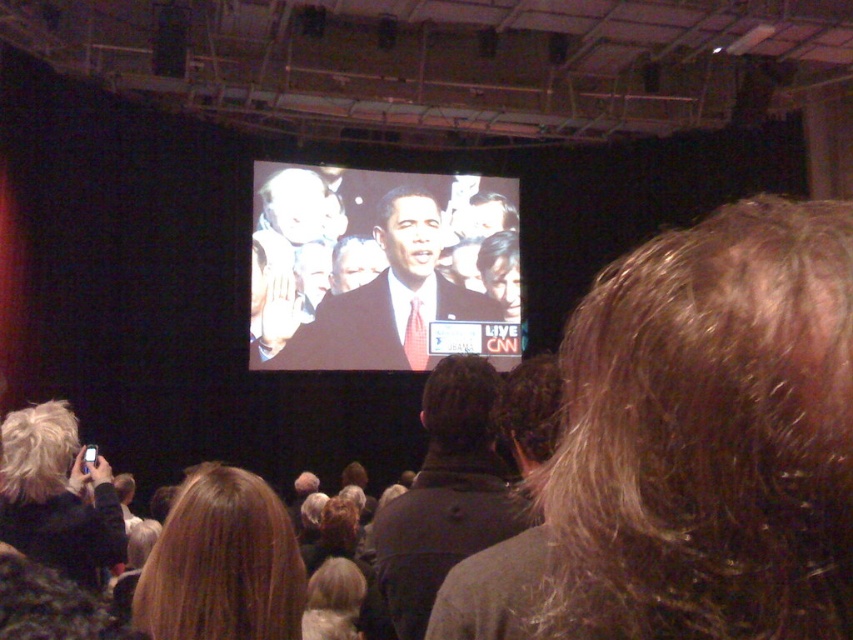
Question: Which point is farther from the camera taking this photo?

Choices:
 (A) (403, 257)
 (B) (503, 512)
 (C) (283, 529)

Answer: (A)

Question: Among these points, which one is nearest to the camera?

Choices:
 (A) (184, 531)
 (B) (438, 458)
 (C) (302, 205)

Answer: (A)

Question: Observing the image, what is the correct spatial positioning of matte black suit at center in reference to dark gray jacket at center?

Choices:
 (A) right
 (B) left

Answer: (B)

Question: Can you confirm if matte black suit at center is positioned above dark gray jacket at center?

Choices:
 (A) no
 (B) yes

Answer: (B)

Question: Is matte black suit at center bigger than blonde hair at lower center?

Choices:
 (A) no
 (B) yes

Answer: (B)

Question: Which point is farther to the camera?

Choices:
 (A) 468,465
 (B) 265,493

Answer: (A)